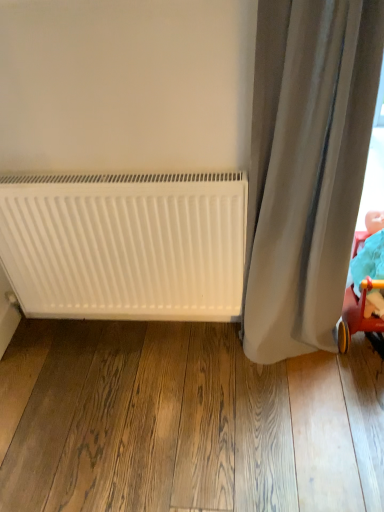
Where is `vacant space in front of gray fabric curtain at right`? vacant space in front of gray fabric curtain at right is located at coordinates (301, 404).